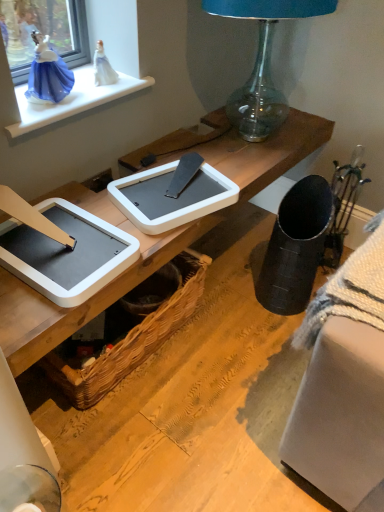
Question: From a real-world perspective, is transparent glass lamp at upper center located higher than white glossy window sill at upper left?

Choices:
 (A) yes
 (B) no

Answer: (A)

Question: Would you say transparent glass lamp at upper center contains white glossy window sill at upper left?

Choices:
 (A) no
 (B) yes

Answer: (A)

Question: From the image's perspective, is transparent glass lamp at upper center below white glossy window sill at upper left?

Choices:
 (A) no
 (B) yes

Answer: (A)

Question: Can you confirm if transparent glass lamp at upper center is shorter than white glossy window sill at upper left?

Choices:
 (A) no
 (B) yes

Answer: (A)

Question: Is the position of transparent glass lamp at upper center more distant than that of white glossy window sill at upper left?

Choices:
 (A) no
 (B) yes

Answer: (A)

Question: Is transparent glass lamp at upper center aimed at white glossy window sill at upper left?

Choices:
 (A) no
 (B) yes

Answer: (A)

Question: Does white glossy window sill at upper left lie in front of woven brown picnic basket at lower center?

Choices:
 (A) yes
 (B) no

Answer: (A)

Question: Is white glossy window sill at upper left shorter than woven brown picnic basket at lower center?

Choices:
 (A) yes
 (B) no

Answer: (A)

Question: Is white glossy window sill at upper left in contact with woven brown picnic basket at lower center?

Choices:
 (A) yes
 (B) no

Answer: (B)

Question: Would you say white glossy window sill at upper left is a long distance from woven brown picnic basket at lower center?

Choices:
 (A) no
 (B) yes

Answer: (A)

Question: Considering the relative sizes of white glossy window sill at upper left and woven brown picnic basket at lower center in the image provided, is white glossy window sill at upper left wider than woven brown picnic basket at lower center?

Choices:
 (A) yes
 (B) no

Answer: (B)

Question: From the image's perspective, does white glossy window sill at upper left appear higher than woven brown picnic basket at lower center?

Choices:
 (A) no
 (B) yes

Answer: (B)

Question: From the image's perspective, is white plastic tablet at center, which is the second tablet computer in left-to-right order, on woven brown picnic basket at lower center?

Choices:
 (A) yes
 (B) no

Answer: (A)